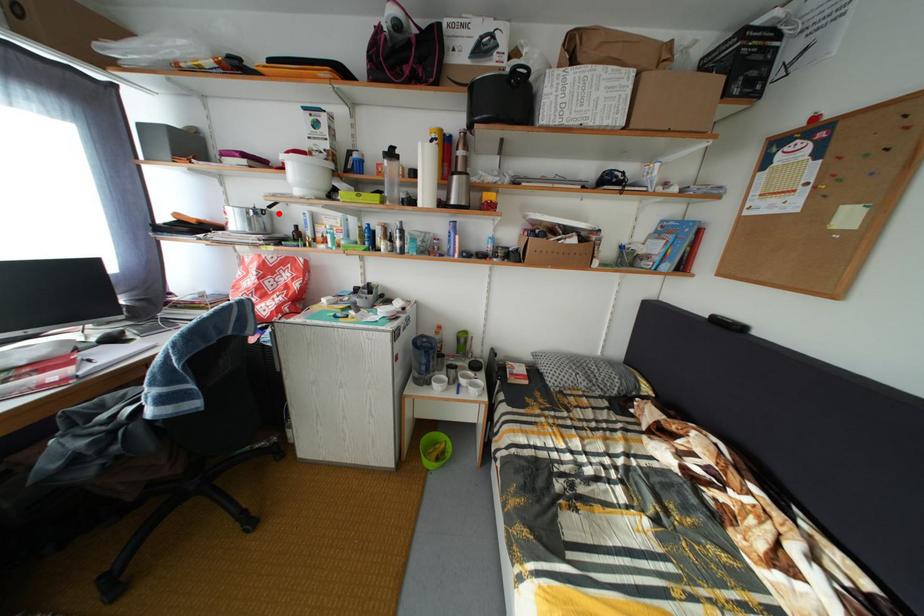
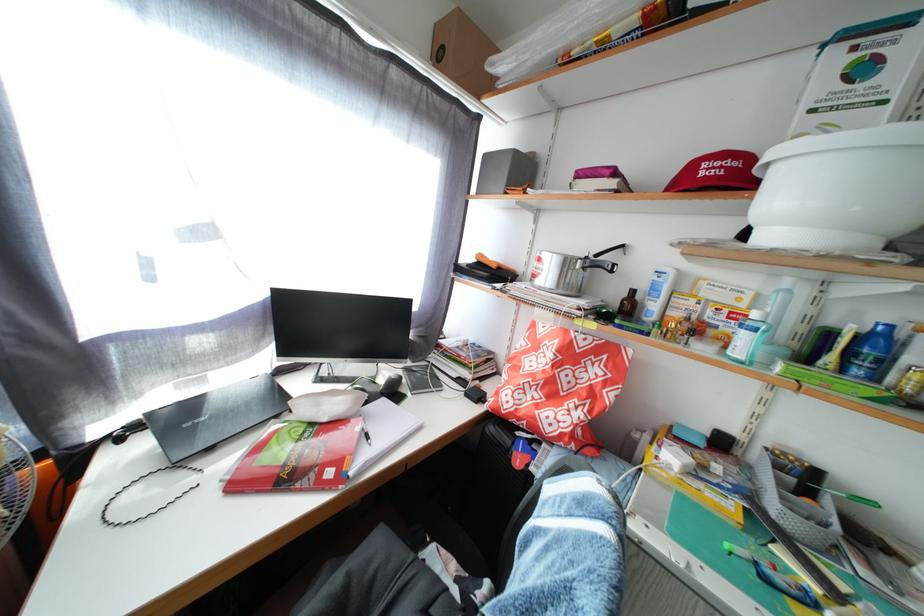
In the second image, find the point that corresponds to the highlighted location in the first image.

(605, 262)